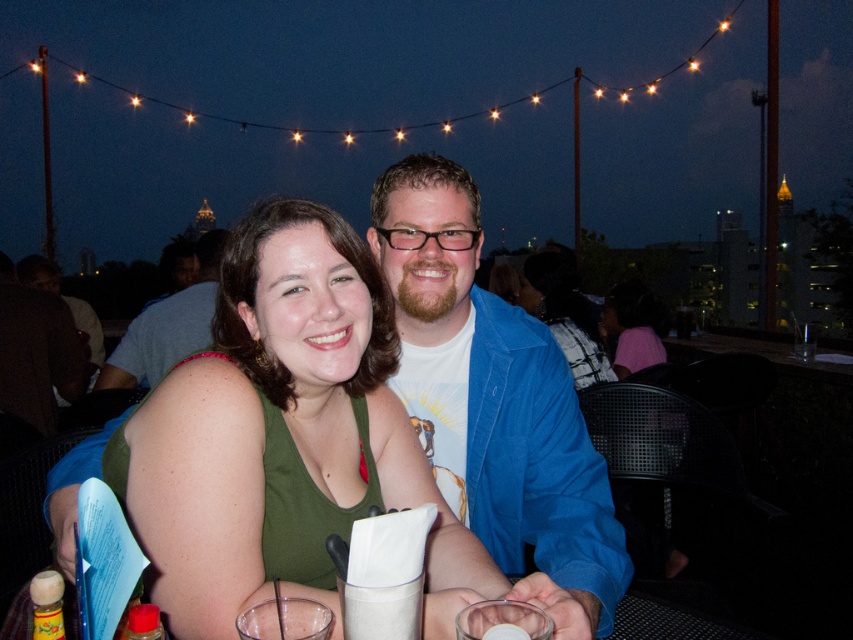
Question: Is blue denim jacket at upper center positioned before clear glass at lower center?

Choices:
 (A) no
 (B) yes

Answer: (A)

Question: Does blue cotton shirt at center appear over clear glass at lower center?

Choices:
 (A) yes
 (B) no

Answer: (A)

Question: Does blue cotton shirt at center appear over blue denim jacket at upper center?

Choices:
 (A) no
 (B) yes

Answer: (A)

Question: Considering the real-world distances, which object is closest to the blue cotton shirt at center?

Choices:
 (A) blue denim jacket at upper center
 (B) green fabric tank top at center
 (C) clear glass at lower center

Answer: (B)

Question: Which object appears farthest from the camera in this image?

Choices:
 (A) clear glass at lower center
 (B) blue cotton shirt at center

Answer: (B)

Question: Estimate the real-world distances between objects in this image. Which object is farther from the blue denim jacket at upper center?

Choices:
 (A) clear glass at lower center
 (B) blue cotton shirt at center
 (C) green fabric tank top at center

Answer: (A)